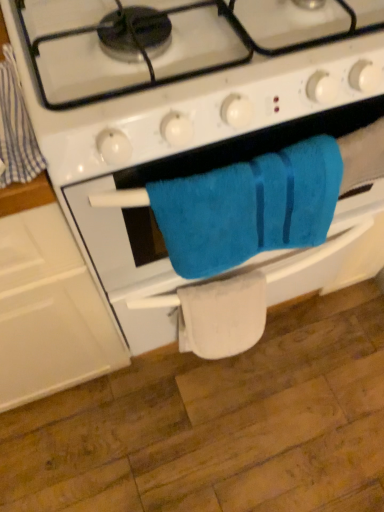
Question: Can you confirm if white fabric towel at lower center is bigger than blue cotton towel at left?

Choices:
 (A) no
 (B) yes

Answer: (B)

Question: Is white fabric towel at lower center looking in the opposite direction of blue cotton towel at left?

Choices:
 (A) no
 (B) yes

Answer: (A)

Question: Is white fabric towel at lower center to the left of blue cotton towel at left from the viewer's perspective?

Choices:
 (A) no
 (B) yes

Answer: (A)

Question: Is white fabric towel at lower center facing towards blue cotton towel at left?

Choices:
 (A) no
 (B) yes

Answer: (A)

Question: From the image's perspective, does white fabric towel at lower center appear lower than blue cotton towel at left?

Choices:
 (A) yes
 (B) no

Answer: (A)

Question: Considering the relative sizes of white fabric towel at lower center and blue cotton towel at left in the image provided, is white fabric towel at lower center shorter than blue cotton towel at left?

Choices:
 (A) no
 (B) yes

Answer: (A)

Question: Is white fabric towel at lower center outside of turquoise soft towel at center?

Choices:
 (A) no
 (B) yes

Answer: (B)

Question: Considering the relative positions of white fabric towel at lower center and turquoise soft towel at center in the image provided, is white fabric towel at lower center in front of turquoise soft towel at center?

Choices:
 (A) yes
 (B) no

Answer: (B)

Question: Is white fabric towel at lower center facing towards turquoise soft towel at center?

Choices:
 (A) yes
 (B) no

Answer: (B)

Question: Is turquoise soft towel at center completely or partially inside white fabric towel at lower center?

Choices:
 (A) no
 (B) yes

Answer: (A)

Question: Is white fabric towel at lower center shorter than turquoise soft towel at center?

Choices:
 (A) yes
 (B) no

Answer: (A)

Question: From the image's perspective, is white fabric towel at lower center above turquoise soft towel at center?

Choices:
 (A) yes
 (B) no

Answer: (B)

Question: Considering the relative sizes of turquoise soft towel at center and white fabric towel at lower center in the image provided, is turquoise soft towel at center shorter than white fabric towel at lower center?

Choices:
 (A) no
 (B) yes

Answer: (A)